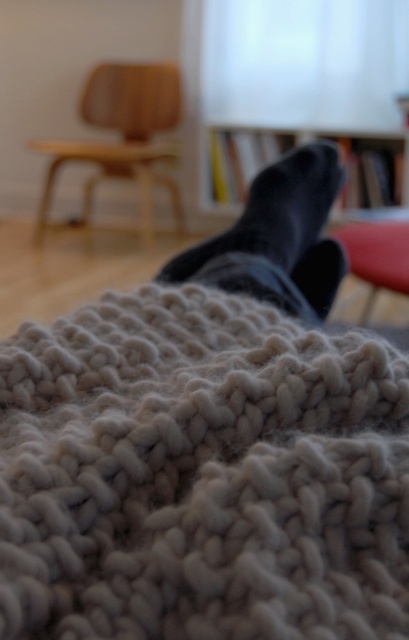
You are examining a knitted blanket up close and notice two points marked on it. The first point is at coordinate point (139, 179) and the second is at point (357, 244). Which point is closer to your eyes?

Point (139, 179) is further to the viewer than point (357, 244), so the first point is closer to your eyes.

You are placing a small decorative item on the fuzzy woolen blanket at lower center. Where should you place it to ensure it stays centered on the blanket?

The fuzzy woolen blanket at lower center is located at point (200, 474), so placing the item at those coordinates would center it on the blanket.

Based on the photo, you are trying to decide whether to place the fuzzy woolen blanket at lower center over the wooden armchair at upper left. Based on their sizes, will the blanket completely cover the armchair?

The fuzzy woolen blanket at lower center is shorter than the wooden armchair at upper left, so it may not completely cover the armchair due to its smaller size.